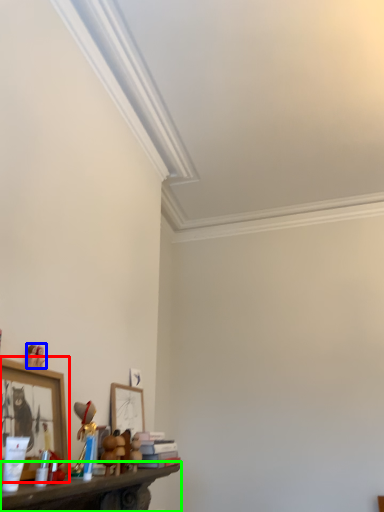
Question: Considering the real-world distances, which object is farthest from picture frame (highlighted by a red box)? toy (highlighted by a blue box) or shelf (highlighted by a green box)?

Choices:
 (A) toy
 (B) shelf

Answer: (B)